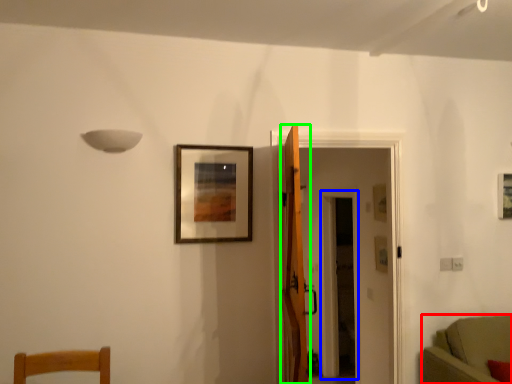
Question: Which object is positioned closest to furniture (highlighted by a red box)? Select from glass door (highlighted by a blue box) and door (highlighted by a green box).

Choices:
 (A) glass door
 (B) door

Answer: (B)